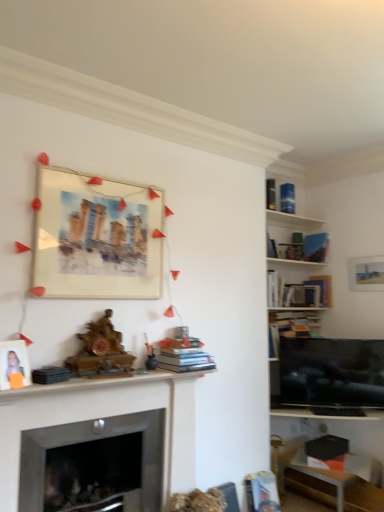
Question: Does hardcover book at upper right, the 5th book viewed from the front, have a smaller size compared to hardcover book at center-right, the 5th book positioned from the left?

Choices:
 (A) no
 (B) yes

Answer: (B)

Question: Is hardcover book at upper right, which appears as the 4th book when viewed from the left, further to camera compared to hardcover book at center-right, which ranks as the 3th book in bottom-to-top order?

Choices:
 (A) yes
 (B) no

Answer: (A)

Question: Is hardcover book at upper right, the 5th book viewed from the front, to the left of hardcover book at center-right, which is counted as the third book, starting from the back, from the viewer's perspective?

Choices:
 (A) yes
 (B) no

Answer: (A)

Question: Is hardcover book at upper right, the second book in the back-to-front sequence, bigger than hardcover book at center-right, the 5th book positioned from the left?

Choices:
 (A) yes
 (B) no

Answer: (B)

Question: Could you tell me if hardcover book at upper right, the 5th book viewed from the front, is facing hardcover book at center-right, which ranks as the 3th book in bottom-to-top order?

Choices:
 (A) no
 (B) yes

Answer: (A)

Question: Based on their sizes in the image, would you say matte white photo frame at left, arranged as the 2th picture frame when viewed from the top, is bigger or smaller than wooden mantelpiece at center?

Choices:
 (A) small
 (B) big

Answer: (A)

Question: Considering the positions of point (3, 364) and point (29, 508), is point (3, 364) closer or farther from the camera than point (29, 508)?

Choices:
 (A) farther
 (B) closer

Answer: (B)

Question: From a real-world perspective, is matte white photo frame at left, the 2th picture frame viewed from the right, above or below wooden mantelpiece at center?

Choices:
 (A) above
 (B) below

Answer: (A)

Question: Considering the relative positions of matte white photo frame at left, the 2th picture frame viewed from the right, and wooden mantelpiece at center in the image provided, is matte white photo frame at left, the 2th picture frame viewed from the right, to the left or to the right of wooden mantelpiece at center?

Choices:
 (A) left
 (B) right

Answer: (A)

Question: In the image, is hardcover book at lower right, arranged as the 1th book when ordered from the bottom, on the left side or the right side of flat screen tv at right?

Choices:
 (A) right
 (B) left

Answer: (B)

Question: Considering the positions of hardcover book at lower right, which is counted as the fifth book, starting from the back, and flat screen tv at right in the image, is hardcover book at lower right, which is counted as the fifth book, starting from the back, taller or shorter than flat screen tv at right?

Choices:
 (A) tall
 (B) short

Answer: (B)

Question: Considering their positions, is hardcover book at lower right, arranged as the 1th book when ordered from the bottom, located in front of or behind flat screen tv at right?

Choices:
 (A) behind
 (B) front

Answer: (B)

Question: Which is correct: hardcover book at lower right, the 5th book in the right-to-left sequence, is inside flat screen tv at right, or outside of it?

Choices:
 (A) inside
 (B) outside

Answer: (B)

Question: Is point click(200, 354) closer or farther from the camera than point click(266, 200)?

Choices:
 (A) farther
 (B) closer

Answer: (B)

Question: Considering the positions of hardcover books at center, the first book in the left-to-right sequence, and hardcover book at upper right, which ranks as the 3th book in left-to-right order, in the image, is hardcover books at center, the first book in the left-to-right sequence, taller or shorter than hardcover book at upper right, which ranks as the 3th book in left-to-right order,?

Choices:
 (A) short
 (B) tall

Answer: (A)